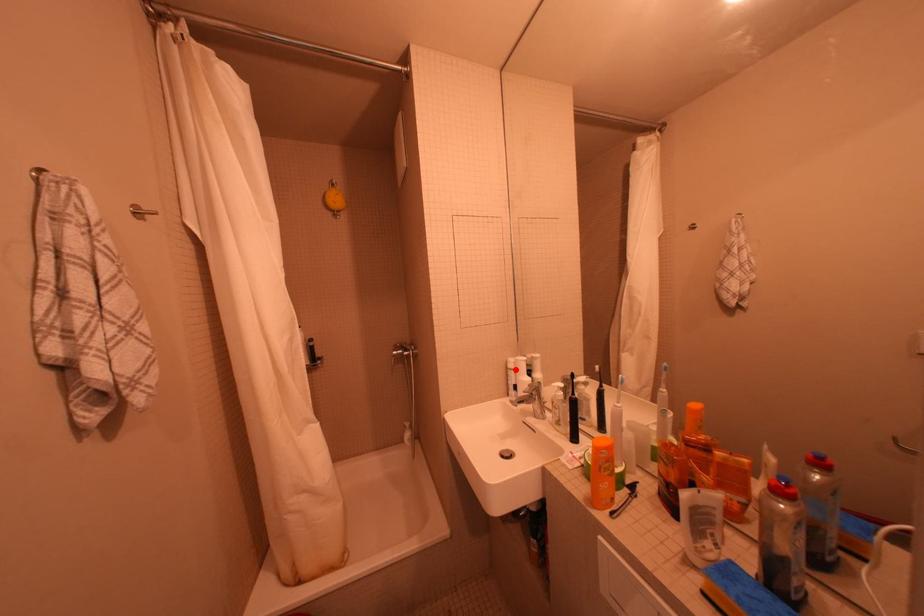
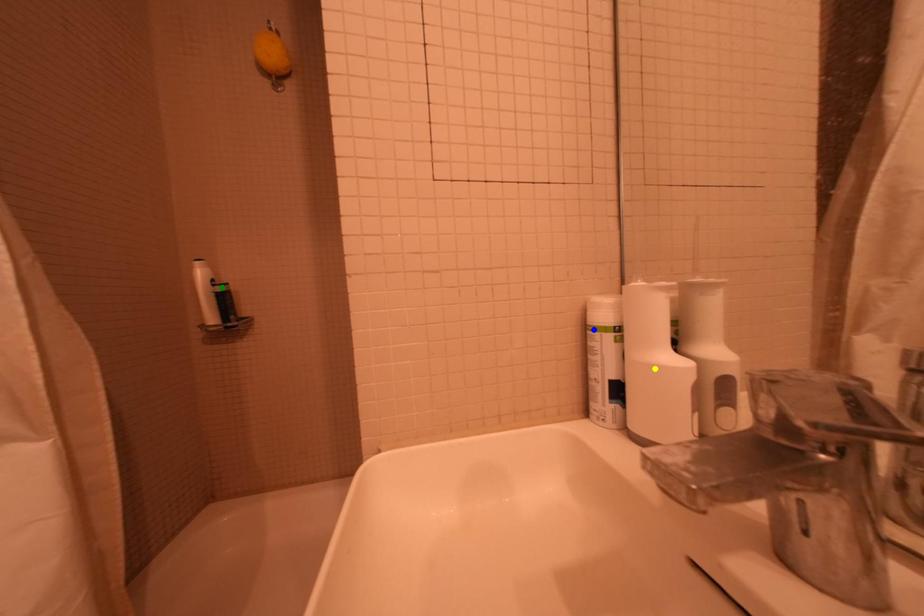
Question: I am providing you with two images of the same scene from different viewpoints. A red point is marked on the first image. You are given multiple points on the second image. Can you choose the point in image 2 that corresponds to the point in image 1?

Choices:
 (A) yellow point
 (B) green point
 (C) blue point

Answer: (C)